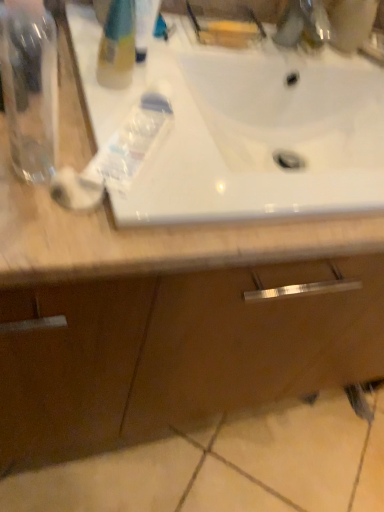
Question: Does point (299, 13) appear closer or farther from the camera than point (122, 57)?

Choices:
 (A) closer
 (B) farther

Answer: (B)

Question: From the image's perspective, relative to translucent plastic bottle at upper left, is metallic faucet at upper right above or below?

Choices:
 (A) below
 (B) above

Answer: (B)

Question: Considering the real-world distances, which object is farthest from the translucent plastic toothpaste at center?

Choices:
 (A) white glossy sink at upper center
 (B) translucent plastic bottle at upper left
 (C) transparent plastic bottle at left
 (D) metallic faucet at upper right

Answer: (D)

Question: Estimate the real-world distances between objects in this image. Which object is farther from the transparent plastic bottle at left?

Choices:
 (A) white glossy sink at upper center
 (B) metallic faucet at upper right
 (C) translucent plastic bottle at upper left
 (D) translucent plastic toothpaste at center

Answer: (B)